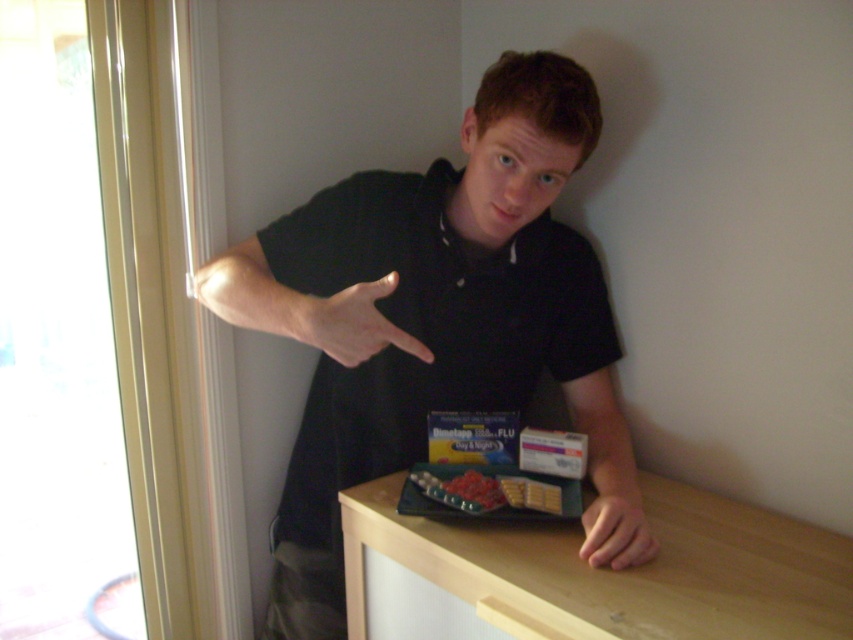
Question: Where is black matte shirt at center located in relation to smooth plastic tray at center in the image?

Choices:
 (A) left
 (B) right

Answer: (A)

Question: Which point is closer to the camera?

Choices:
 (A) (494, 342)
 (B) (619, 528)
 (C) (463, 508)
 (D) (479, 500)

Answer: (B)

Question: Is matte black hand at center to the left of smooth plastic tray at center from the viewer's perspective?

Choices:
 (A) no
 (B) yes

Answer: (B)

Question: Does smooth skin hand at lower right appear under matte black hand at center?

Choices:
 (A) no
 (B) yes

Answer: (B)

Question: Which point is farther to the camera?

Choices:
 (A) (599, 493)
 (B) (463, 483)

Answer: (B)

Question: Which point is farther to the camera?

Choices:
 (A) smooth plastic tray at center
 (B) matte black hand at center
 (C) black matte shirt at center
 (D) smooth skin hand at lower right

Answer: (A)